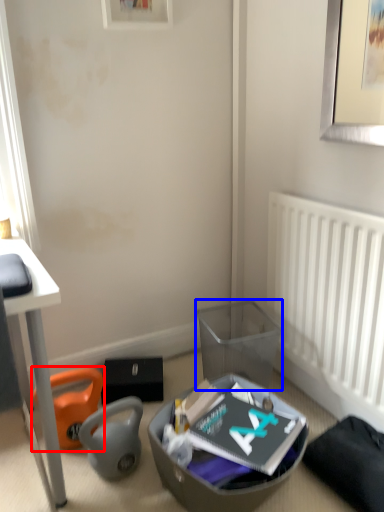
Question: Among these objects, which one is farthest to the camera, bean bag chair (highlighted by a red box) or trash bin/can (highlighted by a blue box)?

Choices:
 (A) bean bag chair
 (B) trash bin/can

Answer: (B)